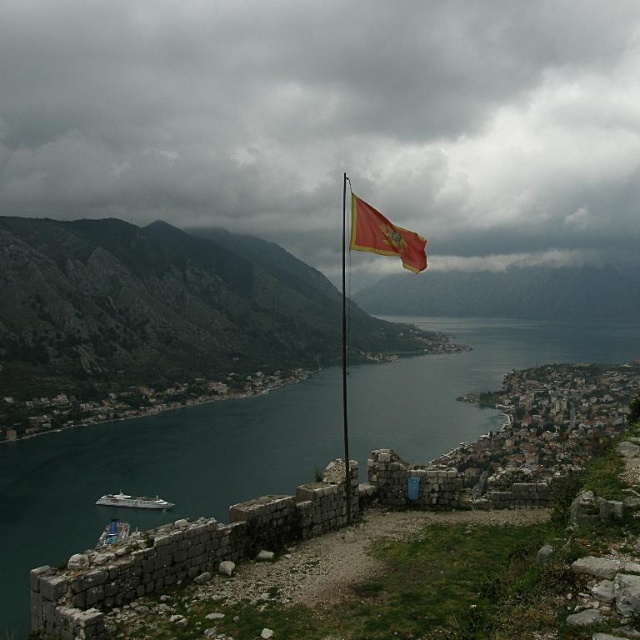
Question: Can you confirm if green water at center is positioned above red flag at center?

Choices:
 (A) yes
 (B) no

Answer: (B)

Question: Is green water at center above red flag at center?

Choices:
 (A) yes
 (B) no

Answer: (B)

Question: Does red flag at center appear on the left side of white glossy ship at lower left?

Choices:
 (A) yes
 (B) no

Answer: (B)

Question: Which point is farther from the camera taking this photo?

Choices:
 (A) (17, 580)
 (B) (413, 236)
 (C) (342, 272)
 (D) (164, 508)

Answer: (C)

Question: Among these points, which one is farthest from the camera?

Choices:
 (A) (160, 499)
 (B) (404, 262)
 (C) (346, 515)

Answer: (A)

Question: Among these points, which one is farthest from the camera?

Choices:
 (A) (301, 429)
 (B) (403, 257)
 (C) (164, 506)
 (D) (342, 448)

Answer: (A)